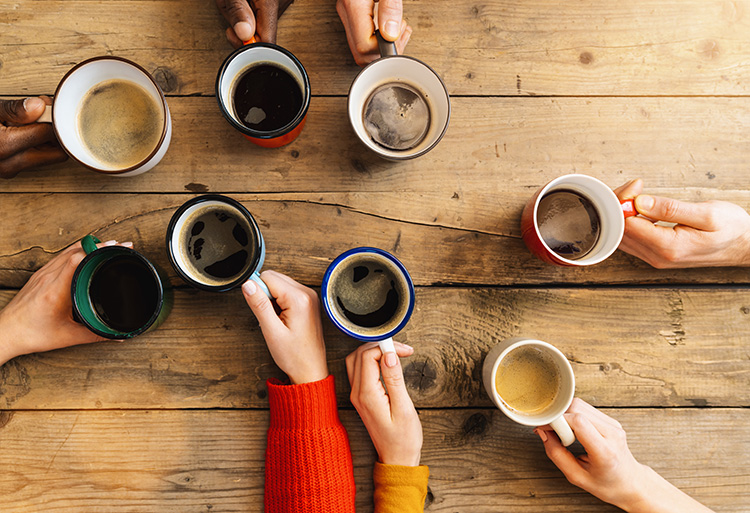
This screenshot has height=513, width=750. I want to click on wood planks, so click(x=484, y=33), click(x=474, y=184), click(x=612, y=349), click(x=480, y=468).